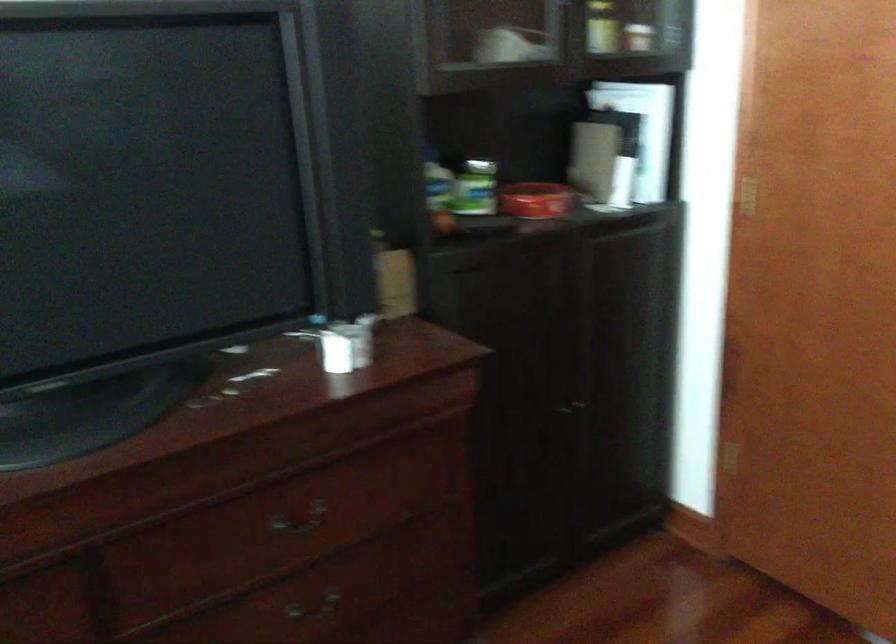
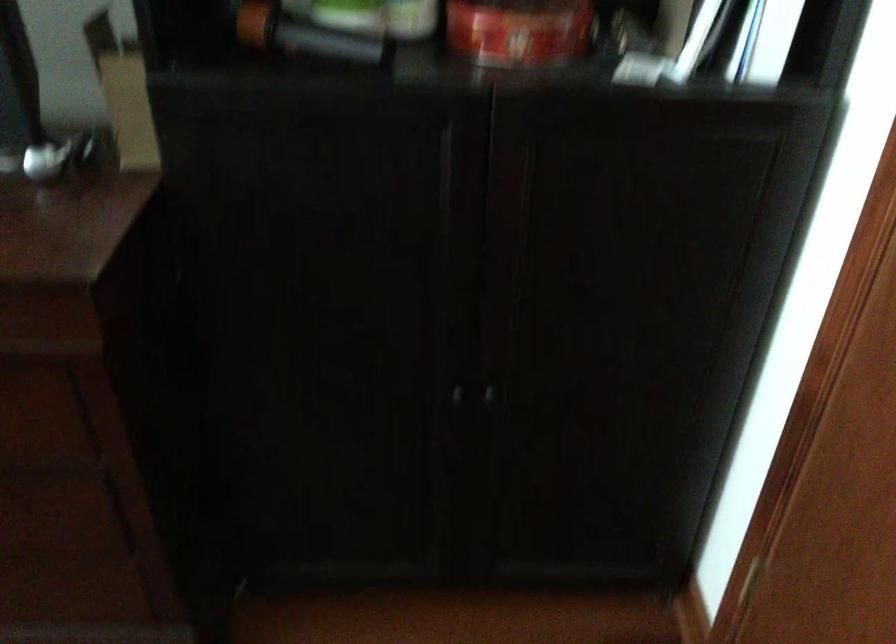
Find the pixel in the second image that matches [466,225] in the first image.

(304, 35)